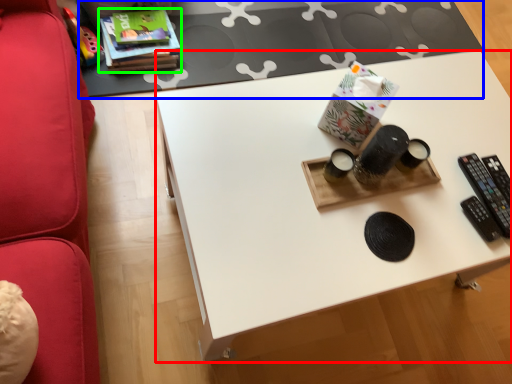
Question: Which is farther away from desk (highlighted by a red box)? table (highlighted by a blue box) or book (highlighted by a green box)?

Choices:
 (A) table
 (B) book

Answer: (B)